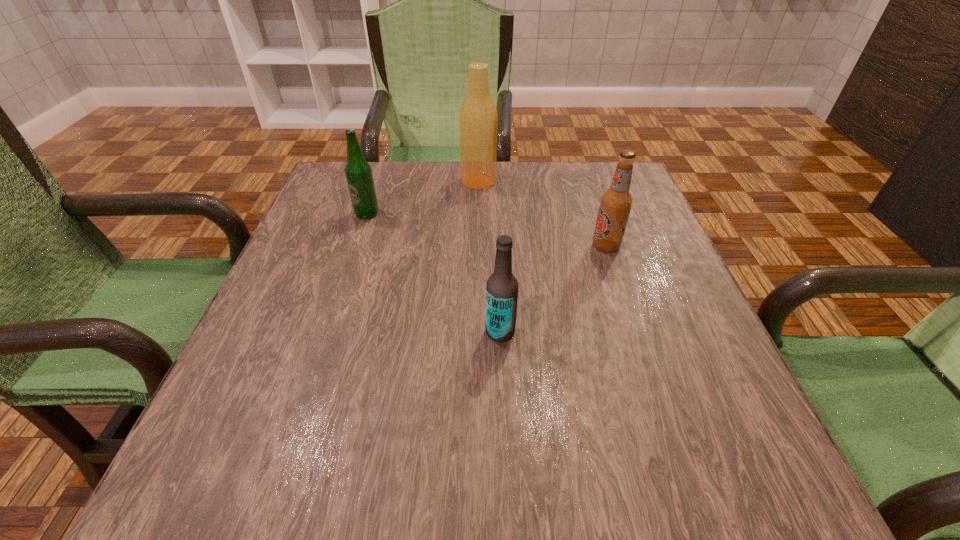
In the image, there is a desktop. What are the coordinates of `free region at the left edge` in the screenshot? It's located at (337, 261).

This screenshot has width=960, height=540. In the image, there is a desktop. What are the coordinates of `vacant area at the right edge` in the screenshot? It's located at (676, 264).

I want to click on vacant position at the far left corner of the desktop, so click(x=323, y=199).

The width and height of the screenshot is (960, 540). What are the coordinates of `free location at the far right corner of the desktop` in the screenshot? It's located at (644, 208).

You are a GUI agent. You are given a task and a screenshot of the screen. Output one action in this format:
    pyautogui.click(x=<x>, y=<y>)
    Task: Click on the vacant space in between the nearest beer bottle and the leftmost beer bottle
    The image size is (960, 540).
    Given the screenshot: What is the action you would take?
    pyautogui.click(x=434, y=273)

Where is `vacant area that lies between the second farthest beer bottle and the second nearest beer bottle`? The image size is (960, 540). vacant area that lies between the second farthest beer bottle and the second nearest beer bottle is located at coordinates (487, 230).

Find the location of a particular element. The height and width of the screenshot is (540, 960). free space between the tallest object and the third farthest beer bottle is located at coordinates (542, 213).

I want to click on vacant point located between the nearest object and the second nearest object, so click(553, 289).

Identify the location of blank region between the tallest beer bottle and the third nearest beer bottle. The width and height of the screenshot is (960, 540). (422, 197).

This screenshot has width=960, height=540. I want to click on free space that is in between the farthest beer bottle and the nearest beer bottle, so click(490, 256).